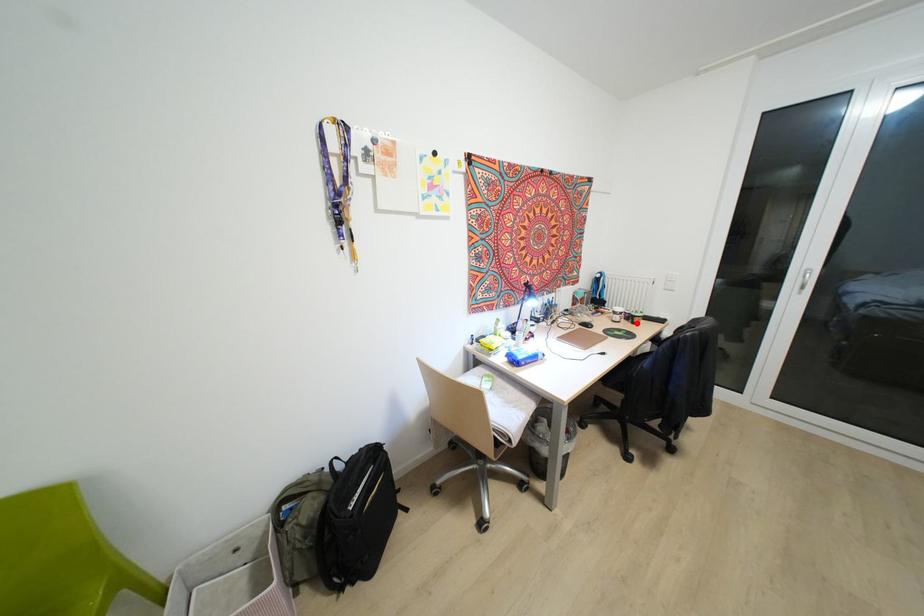
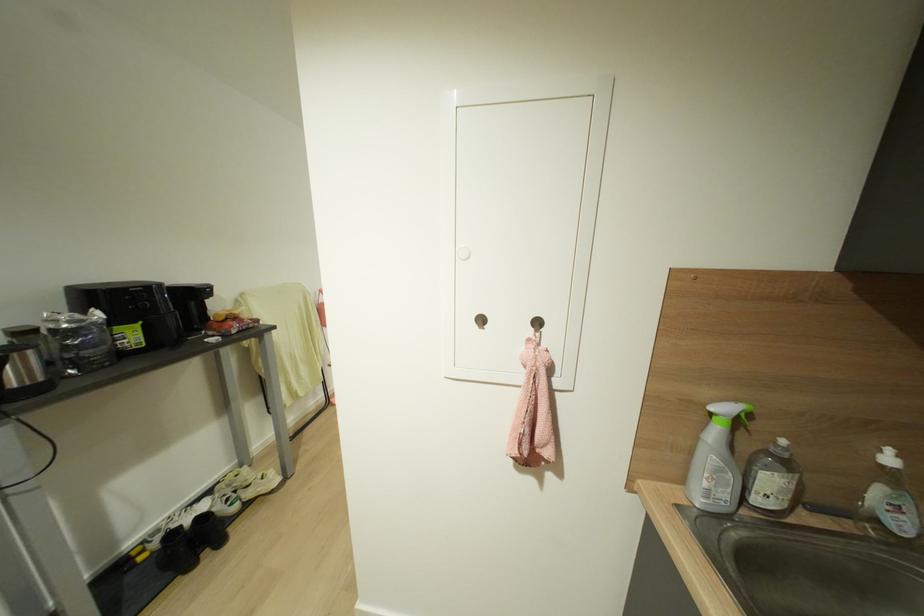
Question: I am providing you with two images of the same scene from different viewpoints. A red point is marked on the first image. Is the red point's position out of view in image 2?

Choices:
 (A) Yes
 (B) No

Answer: (A)